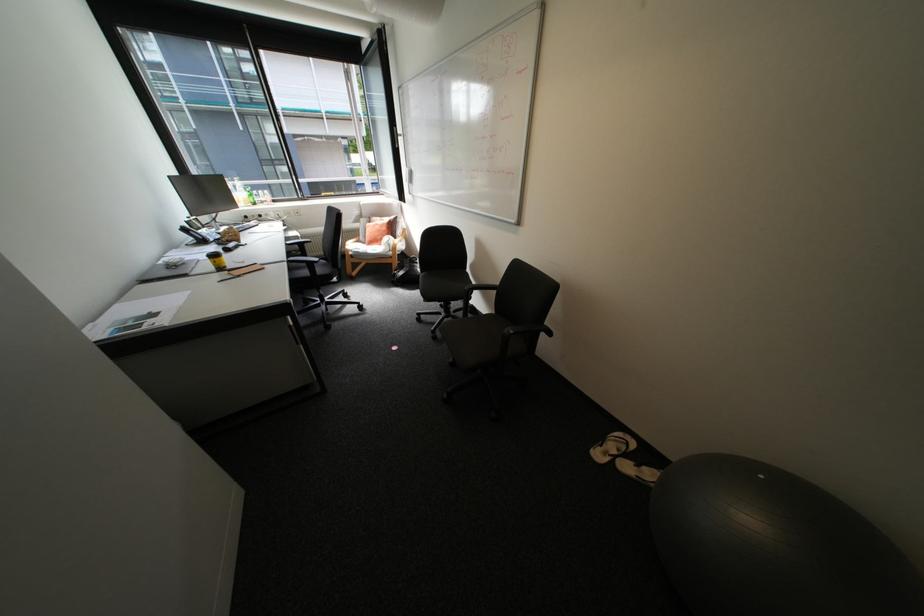
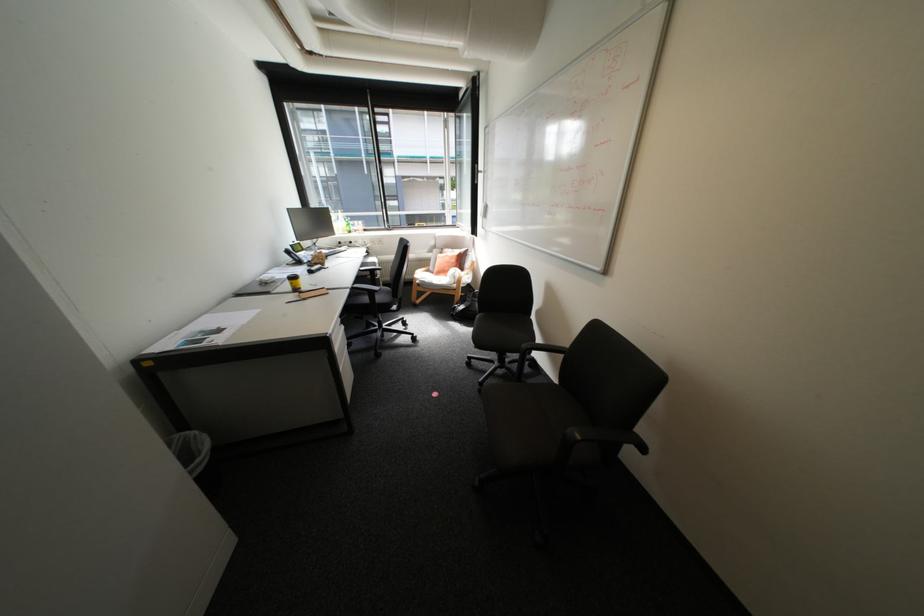
The point at (236, 272) is marked in the first image. Where is the corresponding point in the second image?

(307, 293)